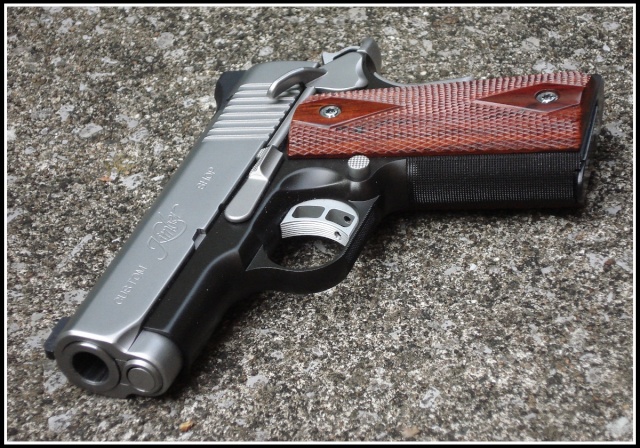
Where is `countertop`? This screenshot has height=448, width=640. countertop is located at coordinates (562, 386).